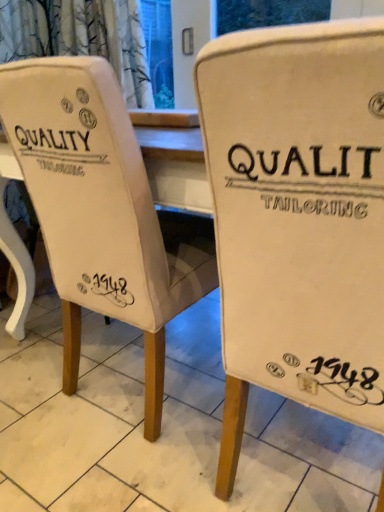
Question: Is white canvas chair at center bigger than white fabric chair at center, the second chair viewed from the right?

Choices:
 (A) yes
 (B) no

Answer: (B)

Question: Can you confirm if white canvas chair at center is taller than white fabric chair at center, the first chair in the left-to-right sequence?

Choices:
 (A) no
 (B) yes

Answer: (A)

Question: Is white canvas chair at center directly adjacent to white fabric chair at center, the second chair viewed from the right?

Choices:
 (A) no
 (B) yes

Answer: (A)

Question: From a real-world perspective, is white canvas chair at center below white fabric chair at center, the second chair viewed from the right?

Choices:
 (A) no
 (B) yes

Answer: (B)

Question: Can you confirm if white canvas chair at center is positioned to the left of white fabric chair at center, the second chair viewed from the right?

Choices:
 (A) yes
 (B) no

Answer: (A)

Question: Considering their positions, is white fabric chair at center, the second chair viewed from the right, located in front of or behind beige fabric chair at center, the first chair from the right?

Choices:
 (A) front
 (B) behind

Answer: (B)

Question: Based on their positions, is white fabric chair at center, the second chair viewed from the right, located to the left or right of beige fabric chair at center, the first chair from the right?

Choices:
 (A) right
 (B) left

Answer: (B)

Question: From the image's perspective, is white fabric chair at center, the second chair viewed from the right, positioned above or below beige fabric chair at center, which is counted as the second chair, starting from the left?

Choices:
 (A) below
 (B) above

Answer: (B)

Question: Does point (49, 71) appear closer or farther from the camera than point (264, 387)?

Choices:
 (A) farther
 (B) closer

Answer: (B)

Question: From a real-world perspective, is white fabric chair at center, the second chair viewed from the right, above or below white canvas chair at center?

Choices:
 (A) below
 (B) above

Answer: (B)

Question: In terms of width, does white fabric chair at center, the first chair in the left-to-right sequence, look wider or thinner when compared to white canvas chair at center?

Choices:
 (A) thin
 (B) wide

Answer: (A)

Question: Looking at the image, does white fabric chair at center, the second chair viewed from the right, seem bigger or smaller compared to white canvas chair at center?

Choices:
 (A) small
 (B) big

Answer: (B)

Question: Do you think white fabric chair at center, the first chair in the left-to-right sequence, is within white canvas chair at center, or outside of it?

Choices:
 (A) outside
 (B) inside

Answer: (A)

Question: From the image's perspective, is white canvas chair at center positioned above or below white fabric chair at center, the first chair in the left-to-right sequence?

Choices:
 (A) below
 (B) above

Answer: (A)

Question: Looking at their shapes, would you say white canvas chair at center is wider or thinner than white fabric chair at center, the second chair viewed from the right?

Choices:
 (A) wide
 (B) thin

Answer: (A)